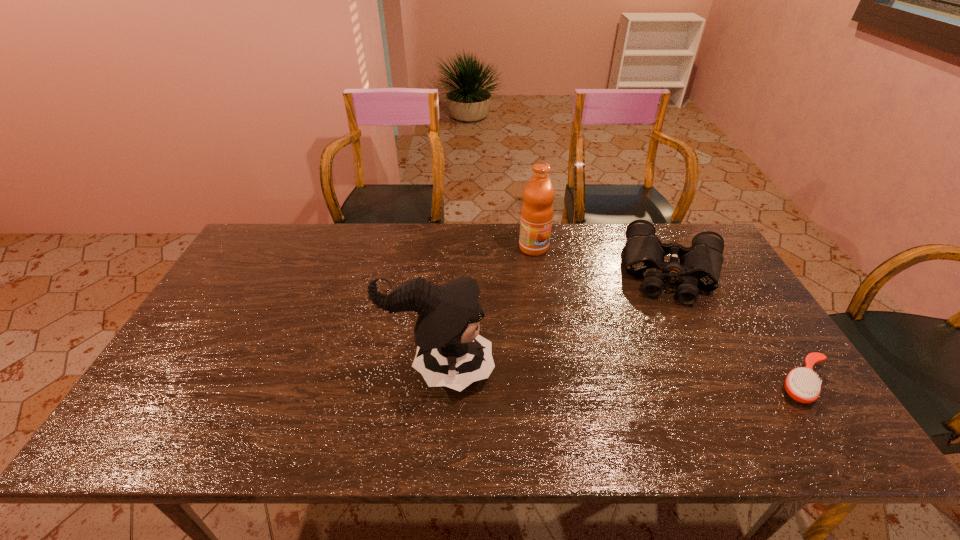
Find the location of `free space at the far edge of the desktop`. free space at the far edge of the desktop is located at coordinates (424, 230).

In order to click on vacant position at the near edge of the desktop in this screenshot , I will do `click(264, 392)`.

Where is `vacant space at the right edge`? This screenshot has height=540, width=960. vacant space at the right edge is located at coordinates (712, 316).

The height and width of the screenshot is (540, 960). Find the location of `blank space at the far right corner of the desktop`. blank space at the far right corner of the desktop is located at coordinates (687, 248).

Image resolution: width=960 pixels, height=540 pixels. I want to click on free space between the leftmost object and the hairbrush, so click(622, 376).

I want to click on vacant area between the binoculars and the hairbrush, so click(x=739, y=327).

Identify the location of unoccupied position between the fruit juice and the second shortest object. (604, 259).

You are a GUI agent. You are given a task and a screenshot of the screen. Output one action in this format:
    pyautogui.click(x=<x>, y=<y>)
    Task: Click on the vacant space in between the fruit juice and the hairbrush
    The width and height of the screenshot is (960, 540).
    Given the screenshot: What is the action you would take?
    pyautogui.click(x=669, y=315)

At what (x,y) coordinates should I click in order to perform the action: click on vacant point located between the doll and the hairbrush. Please return your answer as a coordinate pair (x, y). The width and height of the screenshot is (960, 540). Looking at the image, I should click on (622, 376).

Locate an element on the screen. The height and width of the screenshot is (540, 960). unoccupied area between the leftmost object and the shortest object is located at coordinates tap(622, 376).